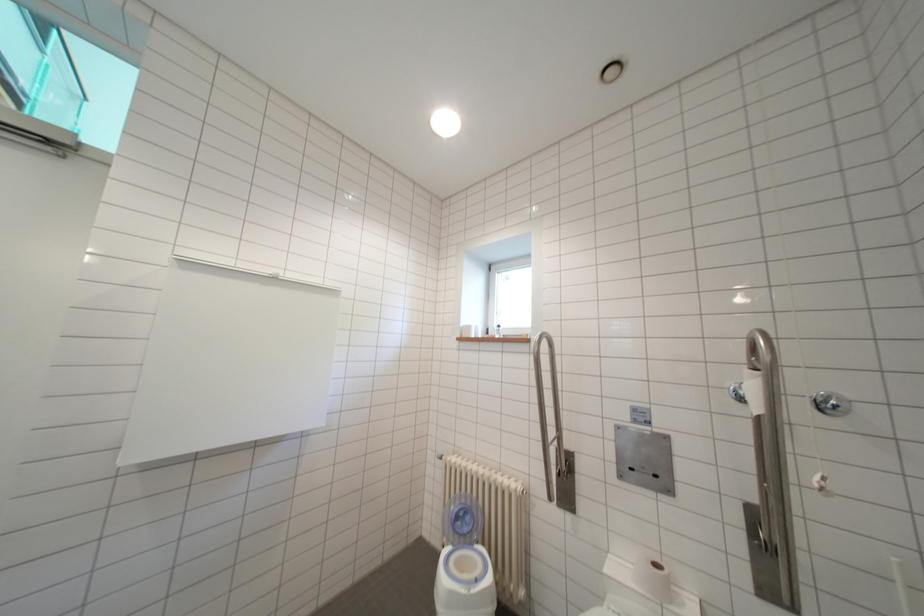
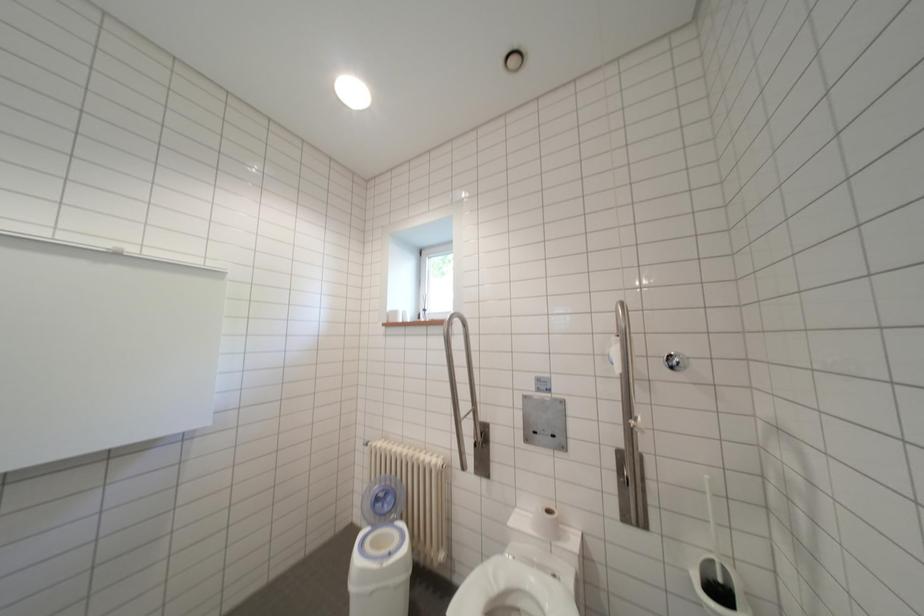
Question: In a continuous first-person perspective shot, in which direction is the camera moving?

Choices:
 (A) Left
 (B) Right
 (C) Forward
 (D) Backward

Answer: (B)